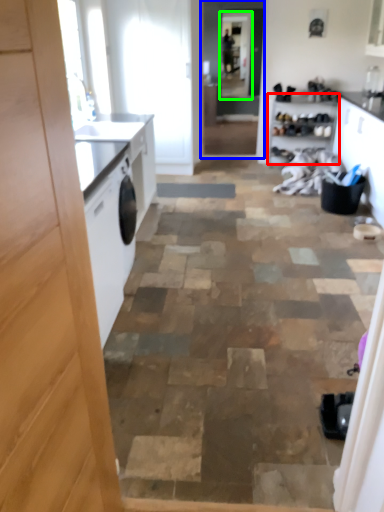
Question: Which is farther away from cabinetry (highlighted by a red box)? screen door (highlighted by a blue box) or screen door (highlighted by a green box)?

Choices:
 (A) screen door
 (B) screen door

Answer: (B)